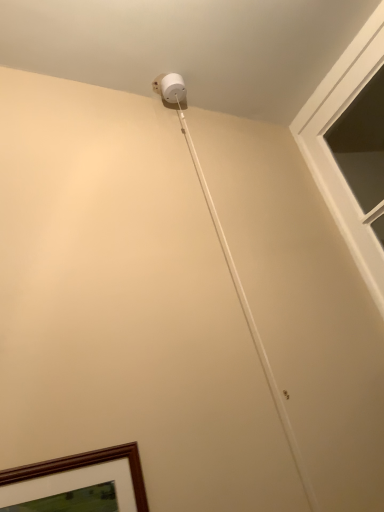
Question: Should I look upward or downward to see white matte string at upper center?

Choices:
 (A) down
 (B) up

Answer: (B)

Question: From a real-world perspective, is white matte string at upper center physically below clear glass window at upper right?

Choices:
 (A) yes
 (B) no

Answer: (A)

Question: Does white matte string at upper center have a lesser height compared to clear glass window at upper right?

Choices:
 (A) no
 (B) yes

Answer: (A)

Question: Is white matte string at upper center completely or partially outside of clear glass window at upper right?

Choices:
 (A) no
 (B) yes

Answer: (B)

Question: Are white matte string at upper center and clear glass window at upper right located far from each other?

Choices:
 (A) no
 (B) yes

Answer: (A)

Question: Is white matte string at upper center closer to the viewer compared to clear glass window at upper right?

Choices:
 (A) no
 (B) yes

Answer: (B)

Question: From the image's perspective, is white matte string at upper center beneath clear glass window at upper right?

Choices:
 (A) yes
 (B) no

Answer: (A)

Question: Can you confirm if clear glass window at upper right is shorter than white matte string at upper center?

Choices:
 (A) yes
 (B) no

Answer: (A)

Question: Can you confirm if clear glass window at upper right is bigger than white matte string at upper center?

Choices:
 (A) no
 (B) yes

Answer: (B)

Question: Can you confirm if clear glass window at upper right is positioned to the right of white matte string at upper center?

Choices:
 (A) no
 (B) yes

Answer: (B)

Question: Can you confirm if clear glass window at upper right is taller than white matte string at upper center?

Choices:
 (A) no
 (B) yes

Answer: (A)

Question: Could white matte string at upper center be considered to be inside clear glass window at upper right?

Choices:
 (A) no
 (B) yes

Answer: (A)

Question: Does clear glass window at upper right have a lesser width compared to white matte string at upper center?

Choices:
 (A) no
 (B) yes

Answer: (A)

Question: From a real-world perspective, is white matte string at upper center positioned above or below clear glass window at upper right?

Choices:
 (A) above
 (B) below

Answer: (B)